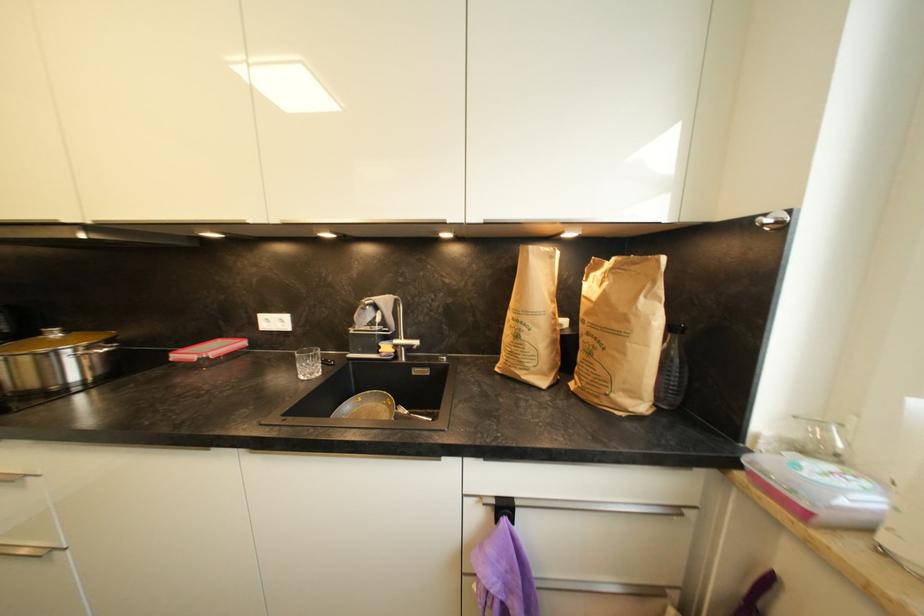
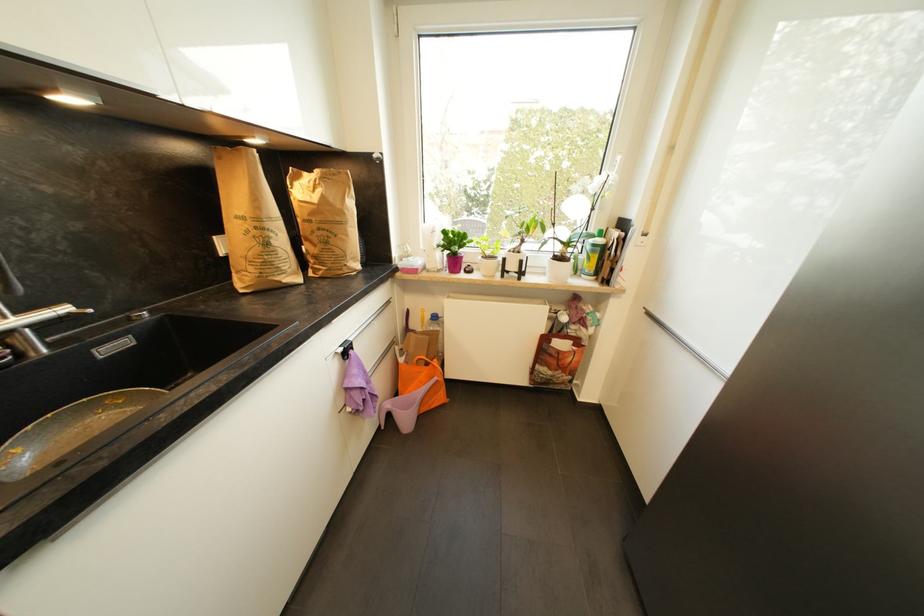
In the second image, find the point that corresponds to [591,315] in the first image.

(317, 216)